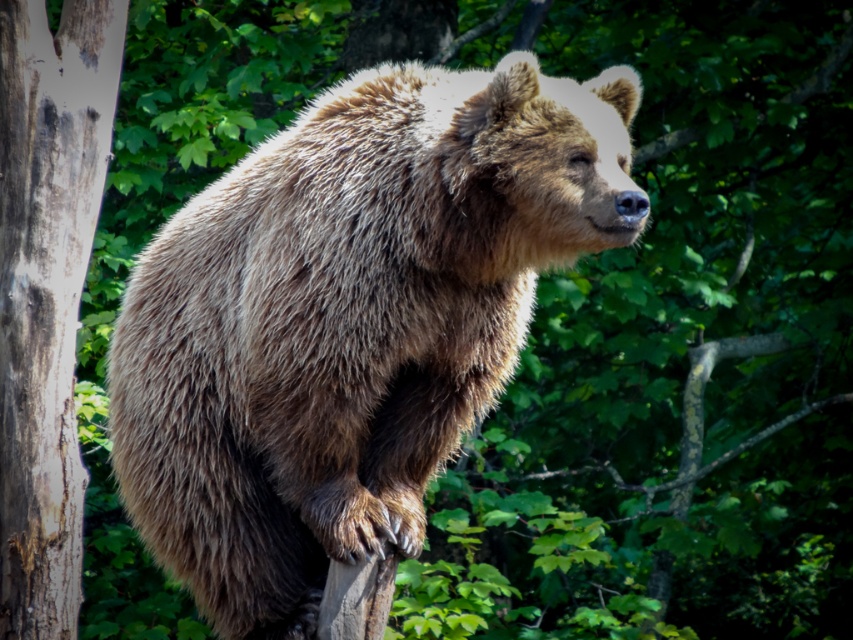
Who is more distant from viewer, (x=361, y=310) or (x=3, y=116)?

Positioned behind is point (x=3, y=116).

Between fuzzy brown bear at center and smooth gray bark at left, which one has more height?

smooth gray bark at left is taller.

Which is in front, point (482, 97) or point (1, 570)?

Positioned in front is point (482, 97).

This screenshot has width=853, height=640. Find the location of `fuzzy brown bear at center`. fuzzy brown bear at center is located at coordinates (350, 320).